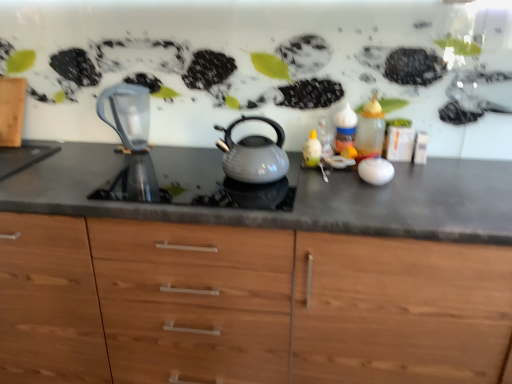
Question: Is matte gray countertop at center far away from translucent glass bottle at right?

Choices:
 (A) yes
 (B) no

Answer: (B)

Question: Is matte gray countertop at center with translucent glass bottle at right?

Choices:
 (A) yes
 (B) no

Answer: (B)

Question: Can you confirm if matte gray countertop at center is bigger than translucent glass bottle at right?

Choices:
 (A) no
 (B) yes

Answer: (B)

Question: From the image's perspective, is matte gray countertop at center located beneath translucent glass bottle at right?

Choices:
 (A) yes
 (B) no

Answer: (A)

Question: Is matte gray countertop at center taller than translucent glass bottle at right?

Choices:
 (A) no
 (B) yes

Answer: (B)

Question: Is matte gray countertop at center wider than translucent glass bottle at right?

Choices:
 (A) no
 (B) yes

Answer: (B)

Question: Is transparent glass jug at left at the back of matte gray countertop at center?

Choices:
 (A) no
 (B) yes

Answer: (A)

Question: Does matte gray countertop at center have a greater height compared to transparent glass jug at left?

Choices:
 (A) yes
 (B) no

Answer: (A)

Question: Can you confirm if matte gray countertop at center is smaller than transparent glass jug at left?

Choices:
 (A) no
 (B) yes

Answer: (A)

Question: Could you tell me if matte gray countertop at center is turned towards transparent glass jug at left?

Choices:
 (A) yes
 (B) no

Answer: (B)

Question: From a real-world perspective, is matte gray countertop at center located higher than transparent glass jug at left?

Choices:
 (A) yes
 (B) no

Answer: (B)

Question: Is matte gray countertop at center next to transparent glass jug at left and touching it?

Choices:
 (A) yes
 (B) no

Answer: (B)

Question: From the image's perspective, does matte gray kettle at center appear higher than transparent glass jug at left?

Choices:
 (A) yes
 (B) no

Answer: (B)